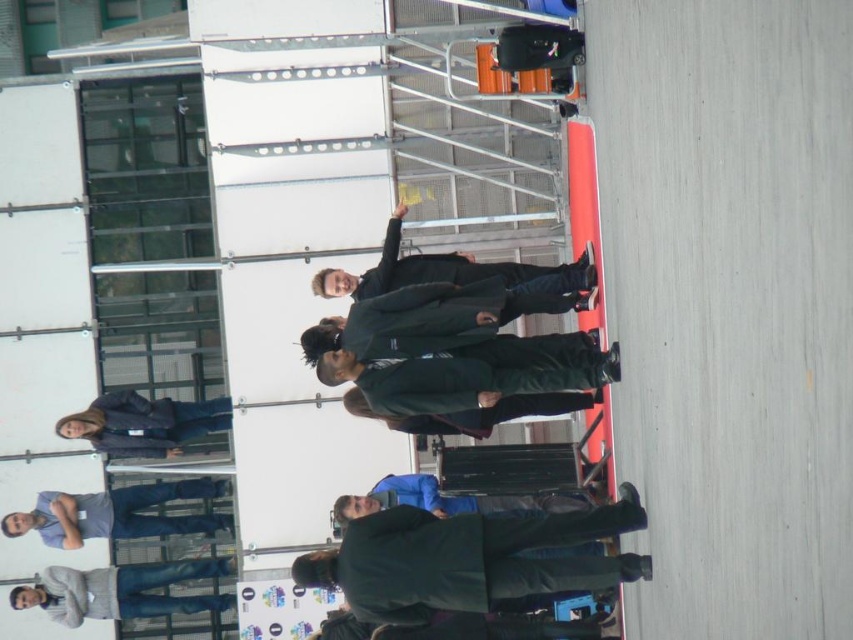
Where is the dark green fabric business suit at center located in the image?

The dark green fabric business suit at center is located at point 0.873 on the x axis and 0.553 on the y axis.

You are a photographer positioned at the back of the stage setup. You need to capture a photo of both the dark green fabric business suit at center and the blue denim jeans at lower left. Which subject will appear larger in your photo?

The dark green fabric business suit at center will appear larger in the photo because it is closer to the viewer than the blue denim jeans at lower left.